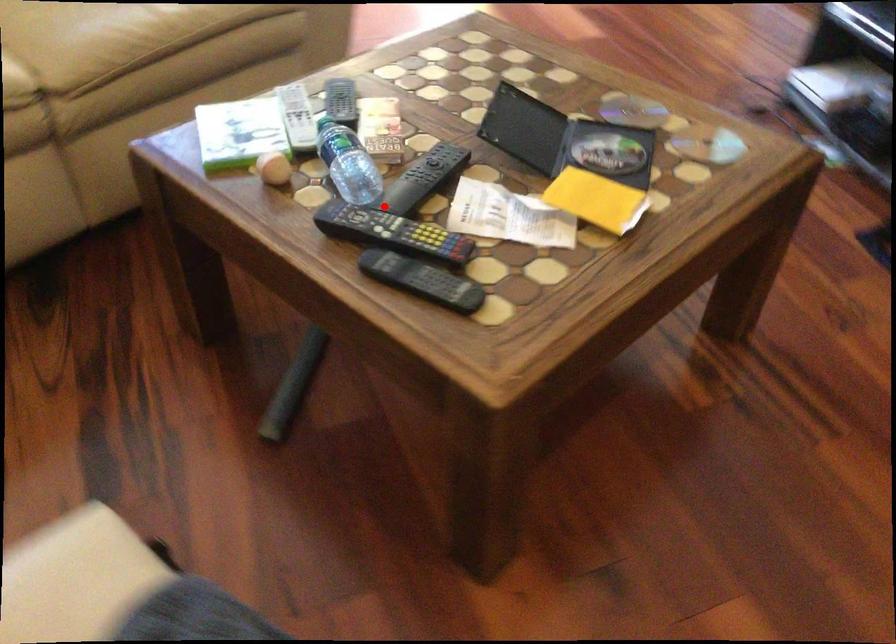
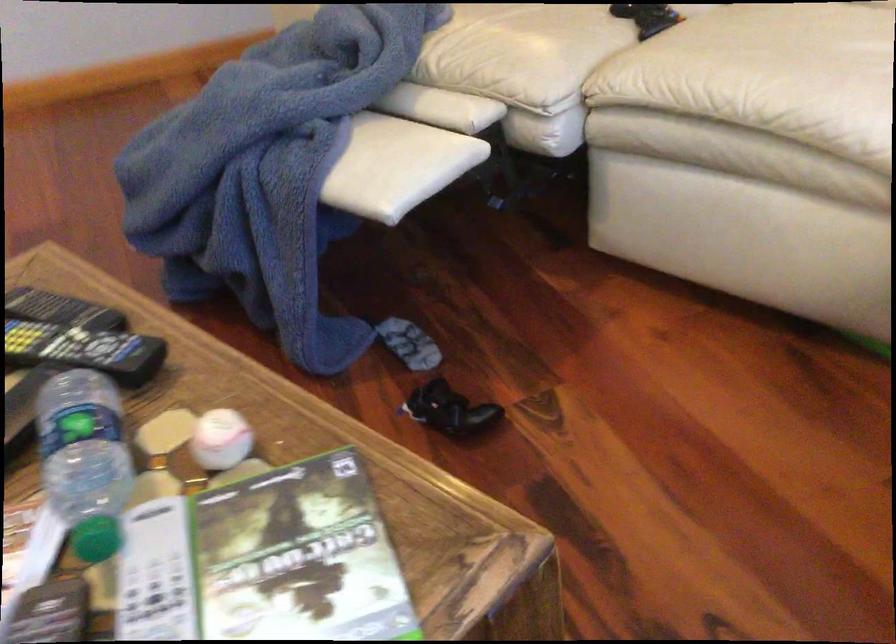
Question: A red point is marked in image1. In image2, is the corresponding 3D point closer to the camera or farther? Reply with the corresponding letter.

Choices:
 (A) The corresponding 3D point is closer.
 (B) The corresponding 3D point is farther.

Answer: (A)